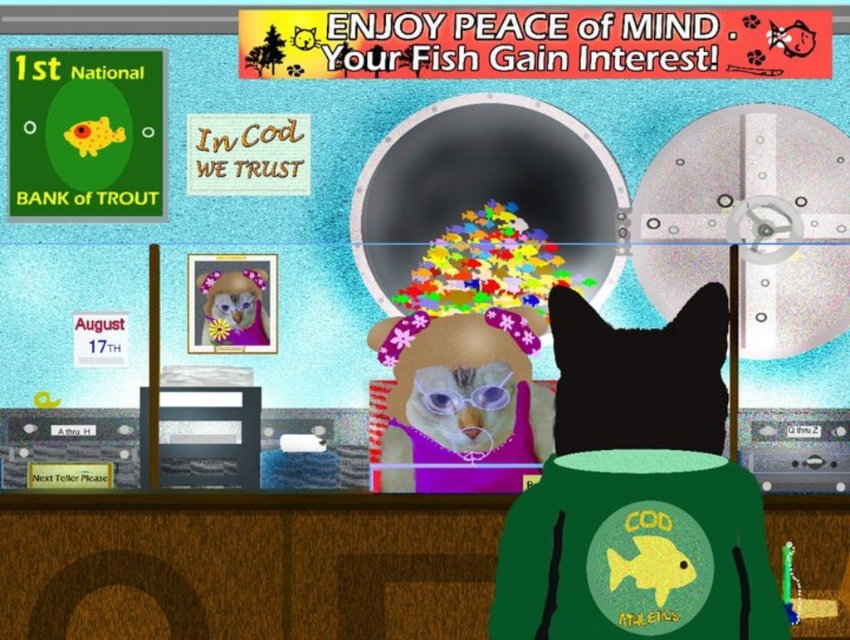
You are a customer entering the bank and see the black fur cat at center and the fluffy pink teddy bear at center. Which one is larger?

The black fur cat at center is bigger than the fluffy pink teddy bear at center.

You are a customer in the bank and want to approach both the black fur cat at center and the fluffy pink teddy bear at center. Which one should you walk towards first if you want to reach the one closer to the entrance?

The fluffy pink teddy bear at center is to the left of the black fur cat at center, so if you want to reach the one closer to the entrance, you should walk towards the fluffy pink teddy bear at center first.

You are a customer in this bank scene. You see a black fur cat at center and a fluffy pink teddy bear at center. Which object is located lower in the image?

The black fur cat at center is positioned under the fluffy pink teddy bear at center, so the black fur cat at center is lower.